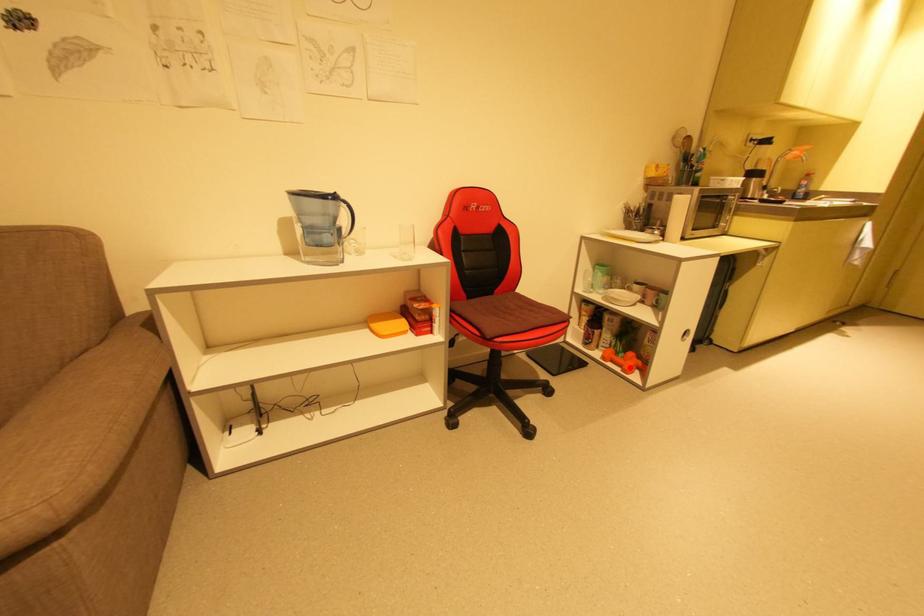
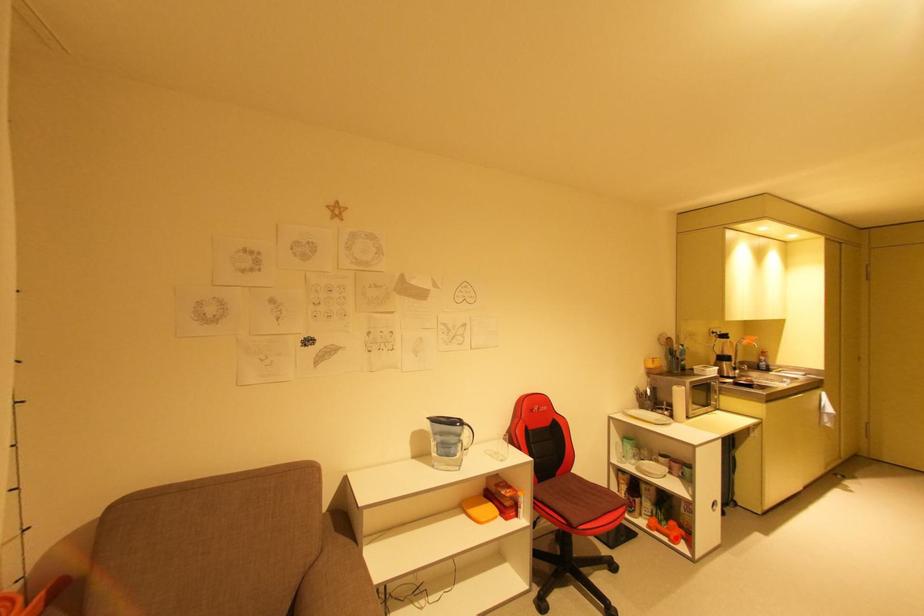
I am providing you with two images of the same scene from different viewpoints. A red point is marked on the first image and another point is marked on the second image. Does the point marked in image1 correspond to the same location as the one in image2?

Yes